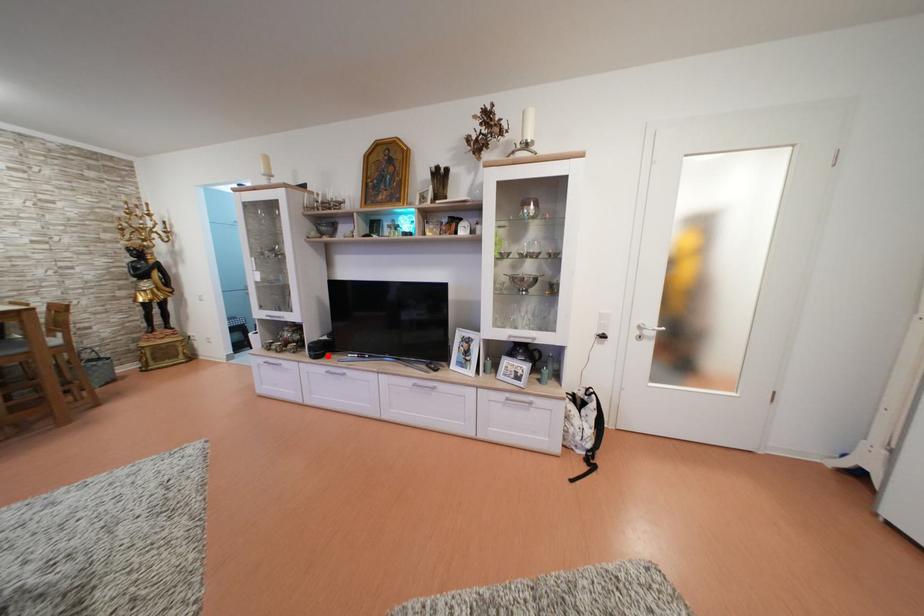
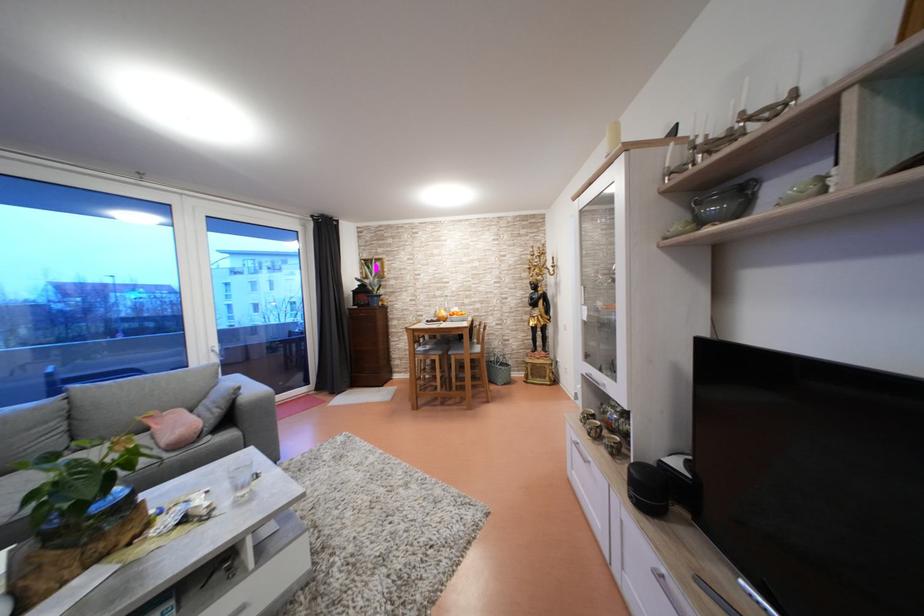
Where in the second image is the point corresponding to the highlighted location from the first image?

(662, 500)